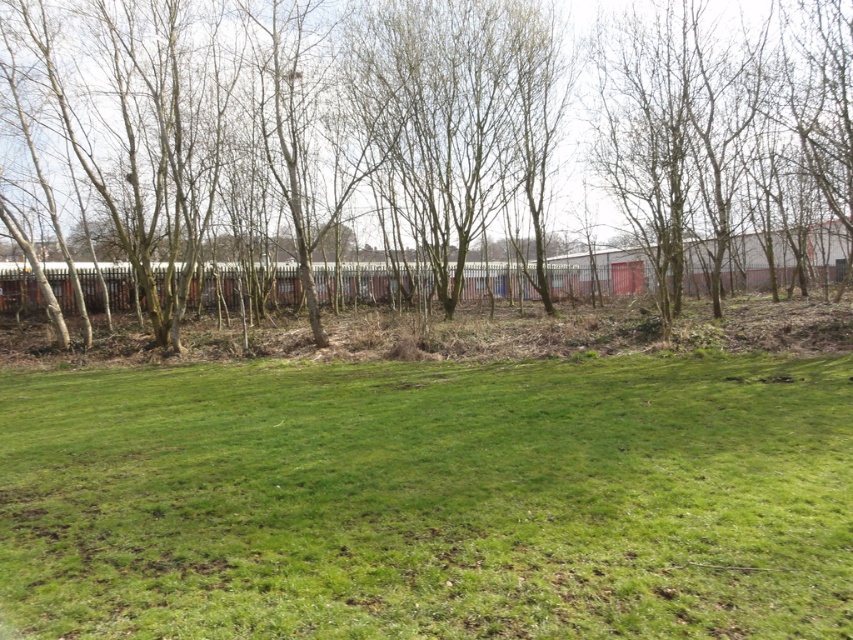
Question: Which point appears closest to the camera in this image?

Choices:
 (A) (730, 72)
 (B) (390, 518)

Answer: (B)

Question: Can you confirm if green grassy field at lower center is thinner than bare wood trees at center?

Choices:
 (A) yes
 (B) no

Answer: (A)

Question: Does green grassy field at lower center have a larger size compared to bare wood trees at center?

Choices:
 (A) no
 (B) yes

Answer: (A)

Question: Is green grassy field at lower center further to the viewer compared to bare wood trees at center?

Choices:
 (A) yes
 (B) no

Answer: (B)